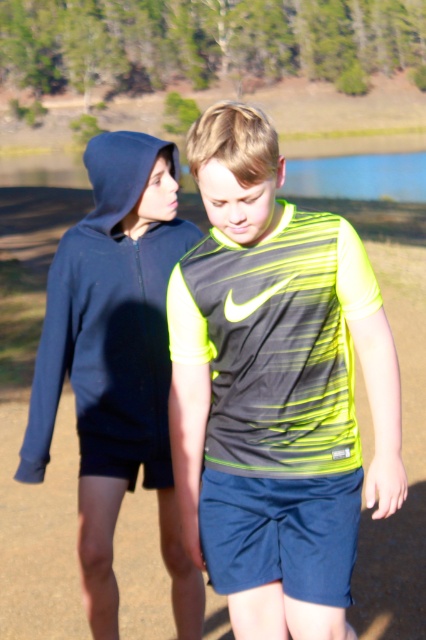
Question: Does neon yellow fabric shirt at center have a smaller size compared to navy blue shorts at center?

Choices:
 (A) no
 (B) yes

Answer: (A)

Question: Can you confirm if neon yellow fabric shirt at center is positioned to the left of navy blue hoodie at left?

Choices:
 (A) no
 (B) yes

Answer: (A)

Question: Estimate the real-world distances between objects in this image. Which object is farther from the navy blue shorts at center?

Choices:
 (A) dirt track at center
 (B) neon yellow fabric shirt at center

Answer: (A)

Question: Which point is closer to the camera taking this photo?

Choices:
 (A) (261, 305)
 (B) (150, 236)

Answer: (A)

Question: Is neon yellow fabric shirt at center in front of navy blue shorts at center?

Choices:
 (A) yes
 (B) no

Answer: (A)

Question: Which point is farther to the camera?

Choices:
 (A) (250, 372)
 (B) (345, 540)
 (C) (5, 536)
 (D) (91, 275)

Answer: (C)